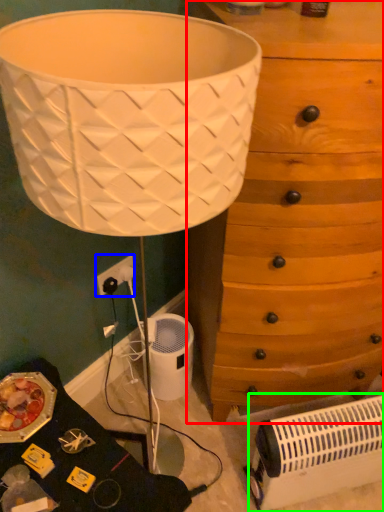
Question: Considering the real-world distances, which object is closest to chest of drawers (highlighted by a red box)? electric outlet (highlighted by a blue box) or heater (highlighted by a green box).

Choices:
 (A) electric outlet
 (B) heater

Answer: (B)